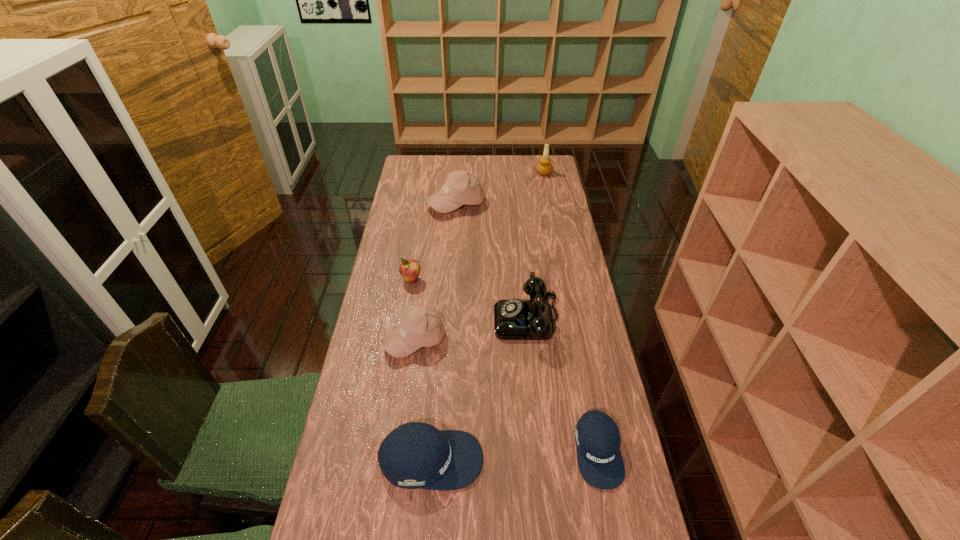
At what (x,y) coordinates should I click in order to perform the action: click on unoccupied position between the third nearest baseball cap and the farthest object. Please return your answer as a coordinate pair (x, y). Looking at the image, I should click on 479,256.

You are a GUI agent. You are given a task and a screenshot of the screen. Output one action in this format:
    pyautogui.click(x=<x>, y=<y>)
    Task: Click on the free space between the fifth nearest object and the second farthest object
    Image resolution: width=960 pixels, height=540 pixels.
    Given the screenshot: What is the action you would take?
    pyautogui.click(x=434, y=242)

This screenshot has width=960, height=540. I want to click on vacant point located between the bigger blue baseball cap and the nearer pink baseball cap, so click(x=423, y=400).

I want to click on free spot between the nearer pink baseball cap and the rightmost baseball cap, so click(x=507, y=396).

This screenshot has width=960, height=540. I want to click on vacant space that is in between the red apple and the bigger blue baseball cap, so click(421, 370).

Locate an element on the screen. The height and width of the screenshot is (540, 960). object that is the closest to the black telephone is located at coordinates (420, 328).

Identify the location of object that stands as the fifth closest to the candle_holder. The image size is (960, 540). (597, 437).

Locate which baseball cap is the closest to the bigger blue baseball cap. Please provide its 2D coordinates. Your answer should be formatted as a tuple, i.e. [(x, y)], where the tuple contains the x and y coordinates of a point satisfying the conditions above.

[(420, 328)]

At what (x,y) coordinates should I click in order to perform the action: click on baseball cap that is the second closest one to the smaller pink baseball cap. Please return your answer as a coordinate pair (x, y). This screenshot has height=540, width=960. Looking at the image, I should click on (597, 437).

The image size is (960, 540). I want to click on free space that satisfies the following two spatial constraints: 1. on the front side of the candle_holder; 2. on the front-facing side of the bigger blue baseball cap, so click(601, 460).